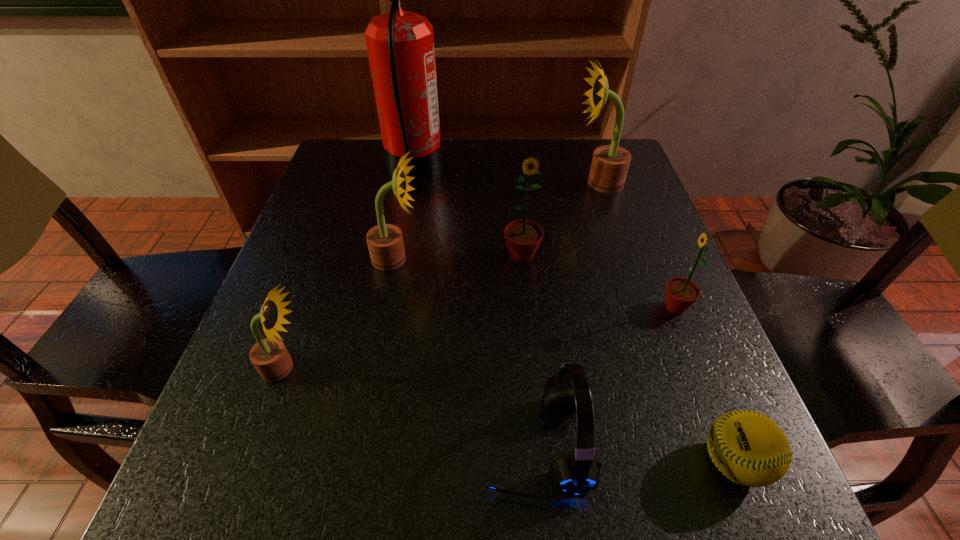
Where is `the nearer green sunflower`? The height and width of the screenshot is (540, 960). the nearer green sunflower is located at coordinates (681, 293).

Locate an element on the screen. The height and width of the screenshot is (540, 960). the second nearest sunflower is located at coordinates (681, 293).

Find the location of a particular element. headset is located at coordinates (576, 470).

The height and width of the screenshot is (540, 960). I want to click on the shortest object, so click(749, 448).

Where is `softball`? softball is located at coordinates (749, 448).

Where is `free location located 0.240m on the front side of the black fire extinguisher`? free location located 0.240m on the front side of the black fire extinguisher is located at coordinates (534, 169).

This screenshot has height=540, width=960. Find the location of `vacant space located on the face of the farthest sunflower`. vacant space located on the face of the farthest sunflower is located at coordinates (548, 183).

Where is `vacant space located 0.310m on the face of the farthest sunflower`? vacant space located 0.310m on the face of the farthest sunflower is located at coordinates click(x=449, y=183).

This screenshot has width=960, height=540. In order to click on vacant space located on the face of the farthest sunflower in this screenshot , I will do `click(552, 183)`.

Find the location of a particular element. This screenshot has height=540, width=960. free space located 0.090m on the face of the second biggest yellow sunflower is located at coordinates (465, 259).